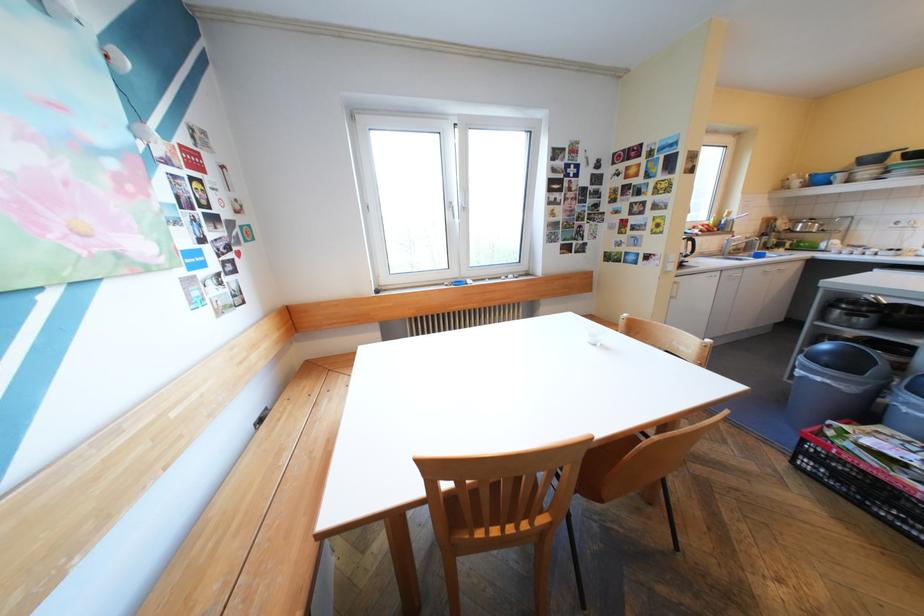
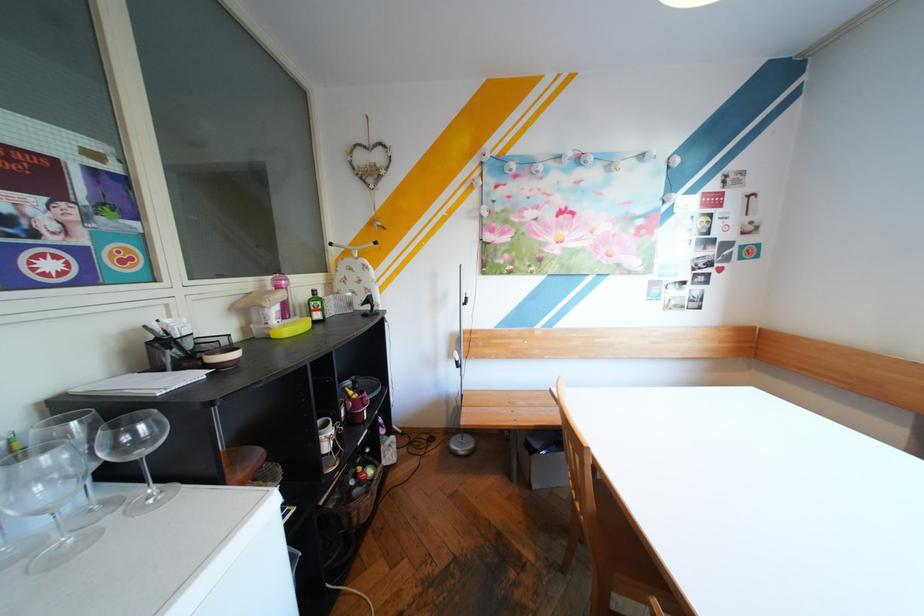
How did the camera likely rotate?

The camera's rotation is toward left-down.